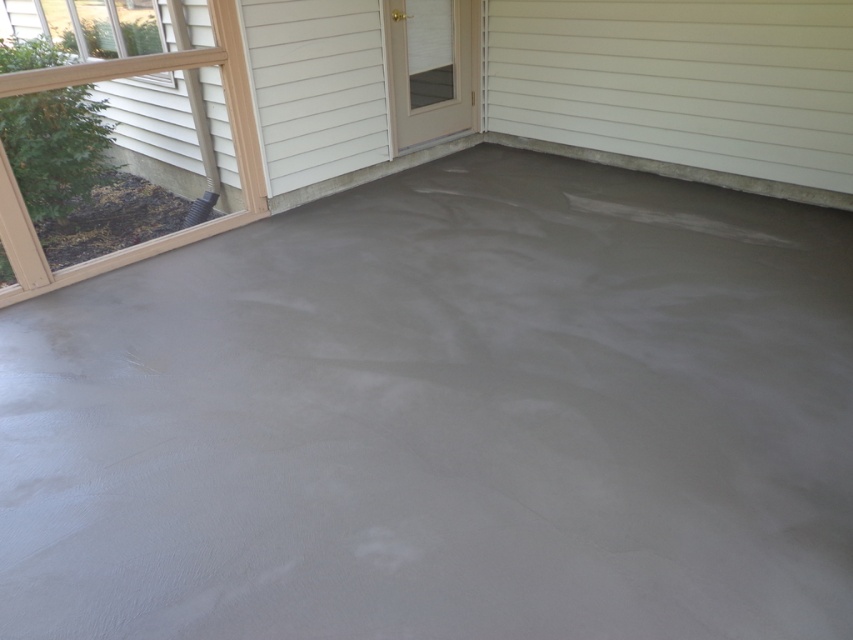
Can you confirm if smooth concrete floor at center is smaller than clear glass screen door at center?

No, smooth concrete floor at center is not smaller than clear glass screen door at center.

Find the location of `smooth concrete floor at center`. smooth concrete floor at center is located at coordinates (438, 106).

Does point (715, 150) lie behind point (426, 32)?

No, it is not.

Locate an element on the screen. This screenshot has width=853, height=640. smooth concrete floor at center is located at coordinates (438, 106).